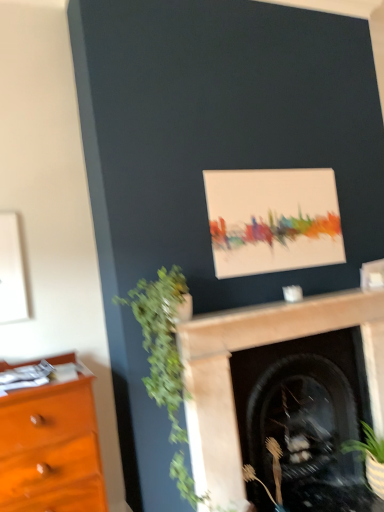
The width and height of the screenshot is (384, 512). I want to click on free point above matte canvas painting at upper center (from a real-world perspective), so click(x=266, y=167).